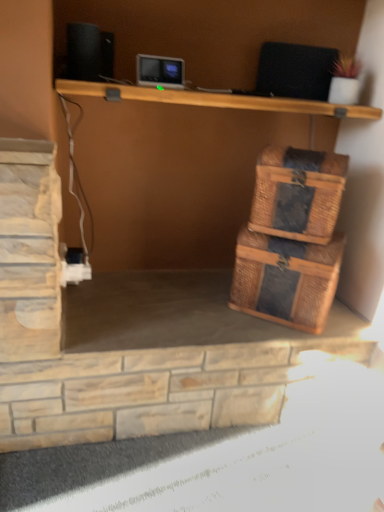
Where is `free space above rattan basket at right (from a real-world perspective)`? This screenshot has height=512, width=384. free space above rattan basket at right (from a real-world perspective) is located at coordinates (311, 152).